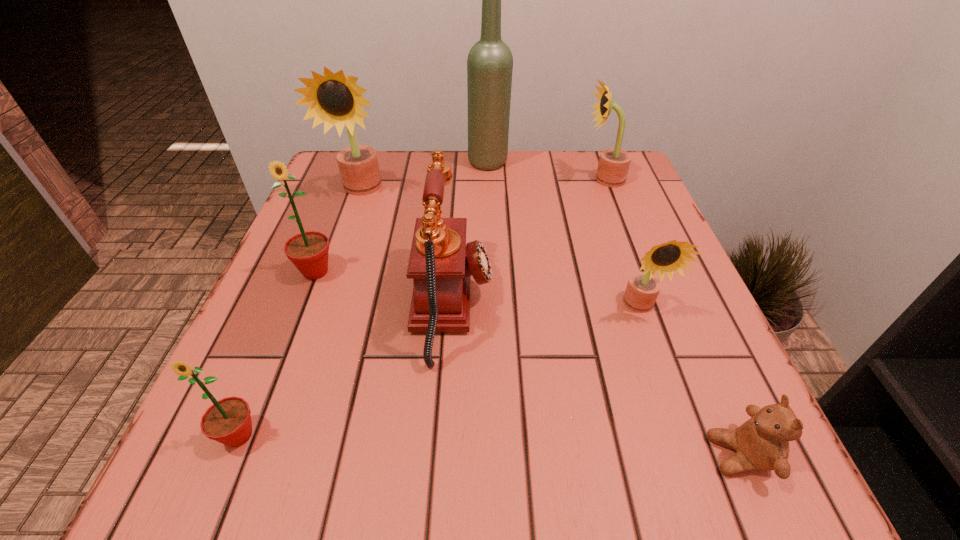
Image resolution: width=960 pixels, height=540 pixels. Find the location of `object that is at the far left corner`. object that is at the far left corner is located at coordinates (335, 99).

Identify the location of object present at the near left corner. (228, 421).

This screenshot has width=960, height=540. In order to click on object positioned at the far right corner in this screenshot , I will do `click(614, 163)`.

This screenshot has height=540, width=960. What are the coordinates of `object present at the near right corner` in the screenshot? It's located at (761, 443).

Identify the location of free space at the far edge of the desktop. The width and height of the screenshot is (960, 540). (531, 195).

At what (x,y) coordinates should I click in order to perform the action: click on vacant region at the near edge. Please return your answer as a coordinate pair (x, y). This screenshot has width=960, height=540. Looking at the image, I should click on (460, 479).

This screenshot has height=540, width=960. I want to click on vacant space at the left edge, so click(x=311, y=309).

This screenshot has height=540, width=960. I want to click on vacant space at the right edge of the desktop, so click(x=613, y=235).

In the image, there is a desktop. At what (x,y) coordinates should I click in order to perform the action: click on vacant space at the far left corner. Please return your answer as a coordinate pair (x, y). The height and width of the screenshot is (540, 960). Looking at the image, I should click on (319, 192).

Where is `free space at the near left corner of the desktop`? The width and height of the screenshot is (960, 540). free space at the near left corner of the desktop is located at coordinates (184, 474).